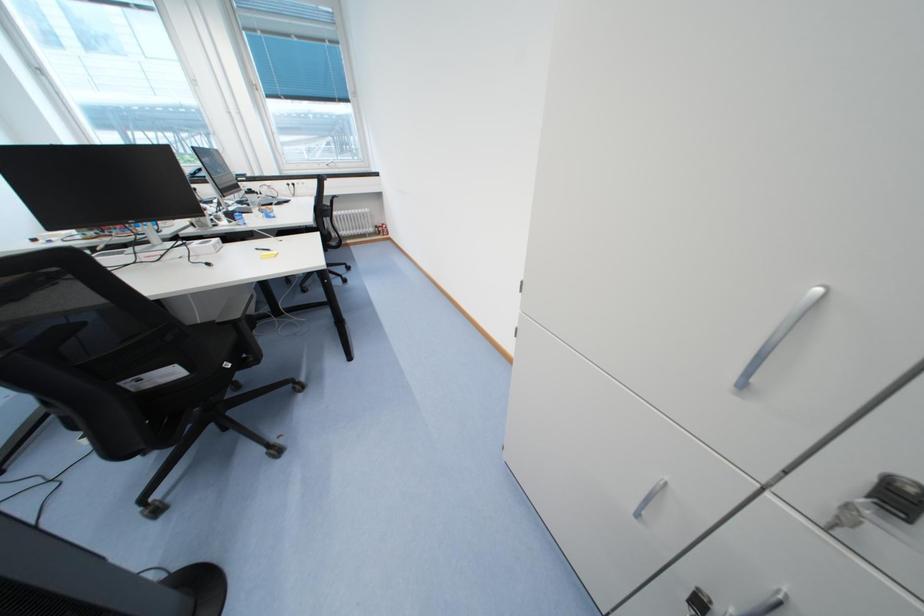
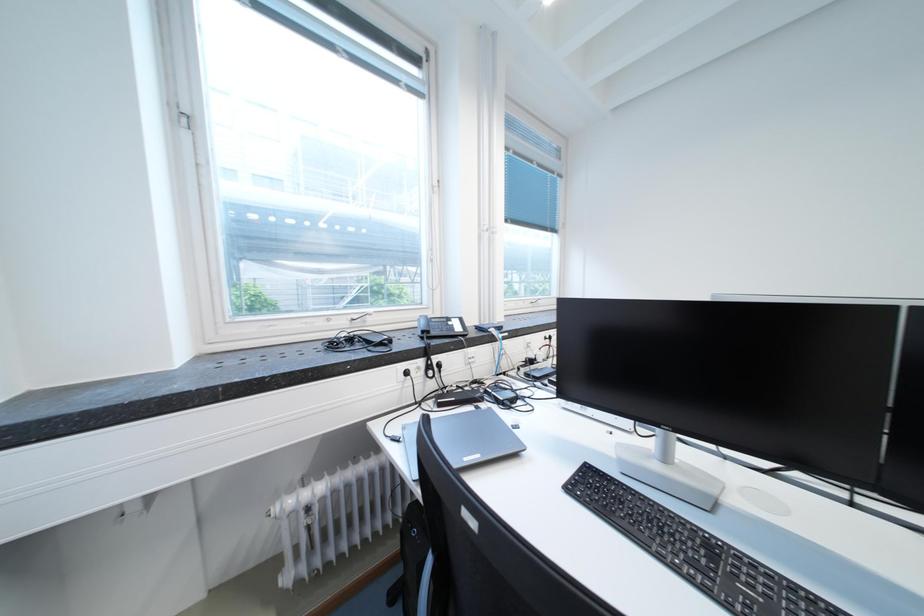
In a continuous first-person perspective shot, in which direction is the camera moving?

The cameraman walked toward left, forward.